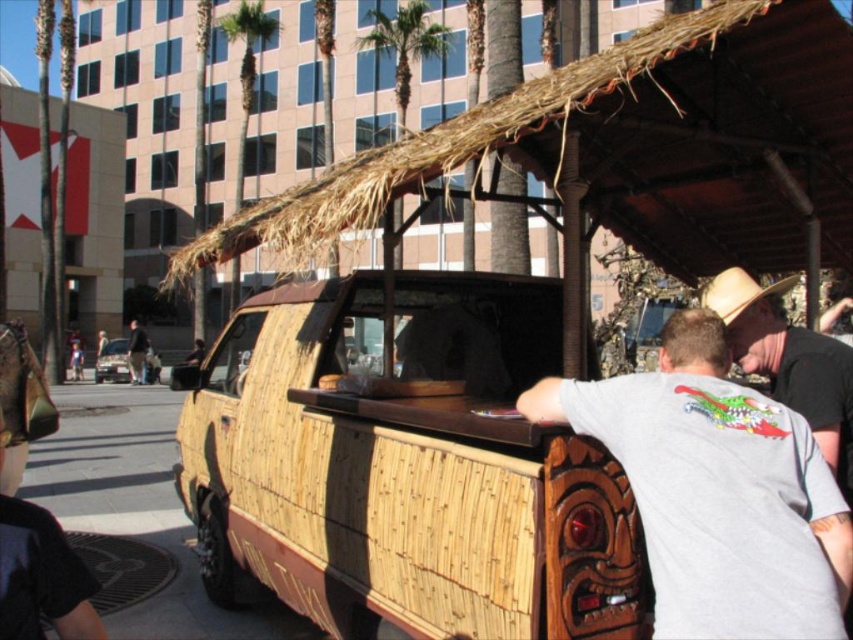
Between bamboo van at center and brown leather hat at right, which one is positioned higher?

brown leather hat at right is higher up.

Consider the image. Who is more distant from viewer, (x=476, y=620) or (x=846, y=349)?

The point (x=476, y=620) is behind.

Measure the distance between bamboo van at center and camera.

bamboo van at center is 2.94 meters away from camera.

You are a GUI agent. You are given a task and a screenshot of the screen. Output one action in this format:
    pyautogui.click(x=<x>, y=<y>)
    Task: Click on the bamboo van at center
    The image size is (853, 640).
    Given the screenshot: What is the action you would take?
    tap(404, 465)

Does light brown straw cowboy hat at upper right appear on the left side of metallic silver car at center?

In fact, light brown straw cowboy hat at upper right is to the right of metallic silver car at center.

Measure the distance between point (773, 284) and camera.

The distance of point (773, 284) from camera is 29.09 feet.

Locate an element on the screen. The width and height of the screenshot is (853, 640). light brown straw cowboy hat at upper right is located at coordinates (738, 292).

Based on the photo, how far apart are brown leather hat at right and light brown straw cowboy hat at upper right?

They are 9.16 inches apart.

From the picture: Which is below, brown leather hat at right or light brown straw cowboy hat at upper right?

brown leather hat at right is lower down.

Does point (846, 477) come closer to viewer compared to point (706, 292)?

Yes, it is.

What are the coordinates of `brown leather hat at right` in the screenshot? It's located at (788, 362).